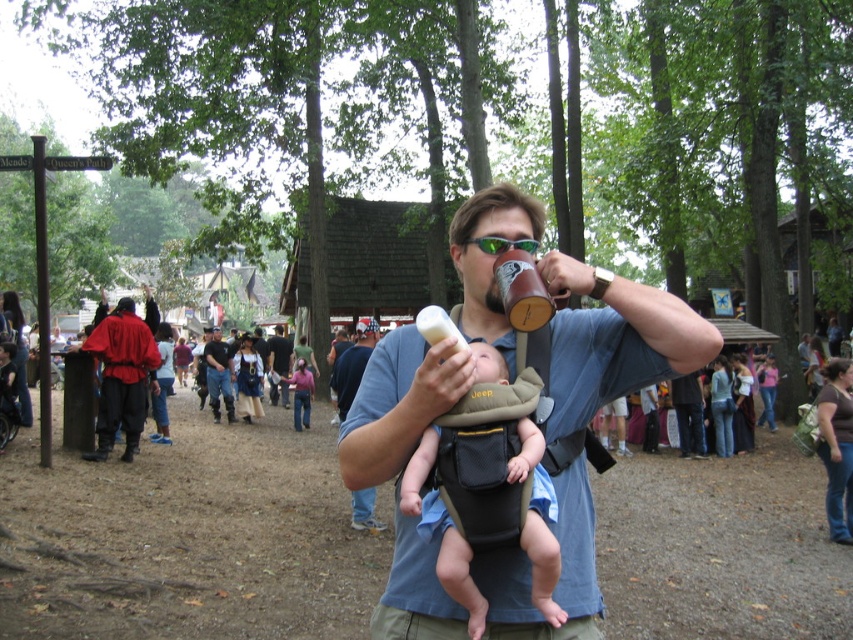
Looking at this image, between soft beige carrier at center and blue denim shirt at center, which one is positioned lower?

Positioned lower is blue denim shirt at center.

Is soft beige carrier at center smaller than blue denim shirt at center?

Yes.

Find the location of a particular element. This screenshot has height=640, width=853. soft beige carrier at center is located at coordinates (503, 481).

Can you confirm if dark brown leather jacket at center is smaller than brushed metal mug at upper center?

Yes, dark brown leather jacket at center is smaller than brushed metal mug at upper center.

Can you confirm if dark brown leather jacket at center is positioned to the left of brushed metal mug at upper center?

No, dark brown leather jacket at center is not to the left of brushed metal mug at upper center.

Locate an element on the screen. The height and width of the screenshot is (640, 853). dark brown leather jacket at center is located at coordinates (218, 376).

Who is more forward, (358, 490) or (287, 355)?

Point (358, 490)

Can you confirm if blue denim shirt at center is shorter than brushed metal mug at upper center?

Incorrect, blue denim shirt at center's height does not fall short of brushed metal mug at upper center's.

The image size is (853, 640). Identify the location of blue denim shirt at center. (352, 364).

At what (x,y) coordinates should I click in order to perform the action: click on blue denim shirt at center. Please return your answer as a coordinate pair (x, y). This screenshot has height=640, width=853. Looking at the image, I should click on 352,364.